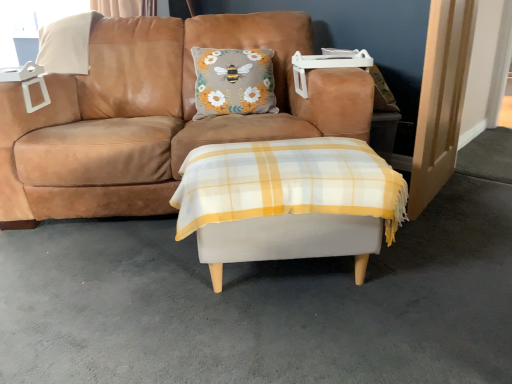
Find the location of a particular element. The width and height of the screenshot is (512, 384). free spot to the right of light wood door at right is located at coordinates pos(479,197).